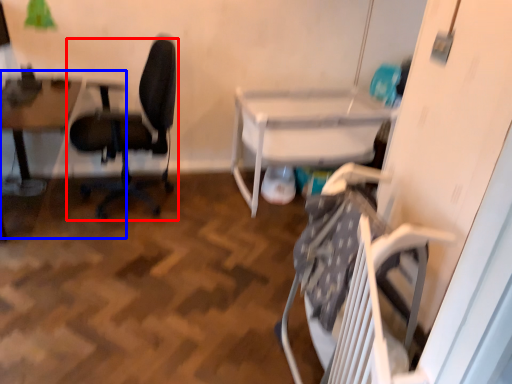
Question: Which object appears closest to the camera in this image, chair (highlighted by a red box) or table (highlighted by a blue box)?

Choices:
 (A) chair
 (B) table

Answer: (A)